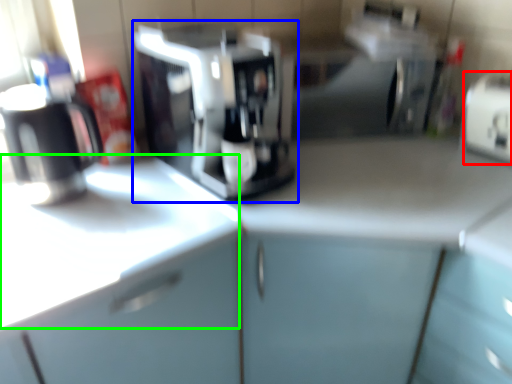
Question: Based on their relative distances, which object is nearer to appliance (highlighted by a red box)? Choose from coffee maker (highlighted by a blue box) and counter top (highlighted by a green box).

Choices:
 (A) coffee maker
 (B) counter top

Answer: (A)